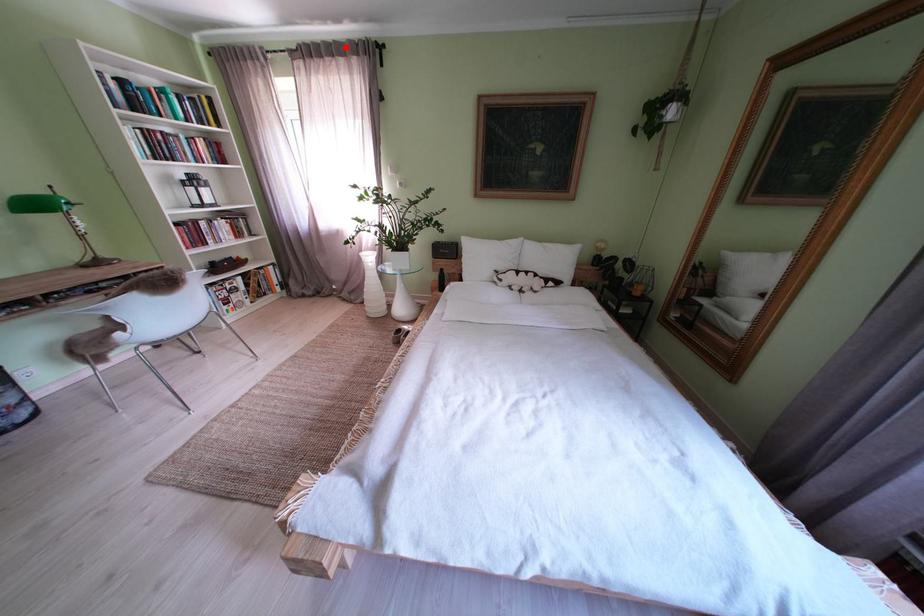
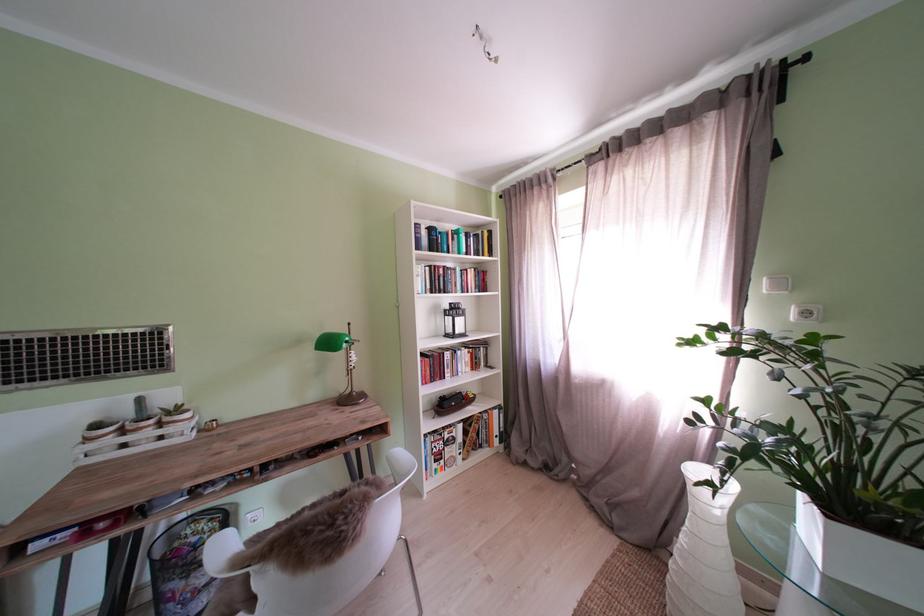
Where in the second image is the point corresponding to the highlighted location from the first image?

(681, 116)